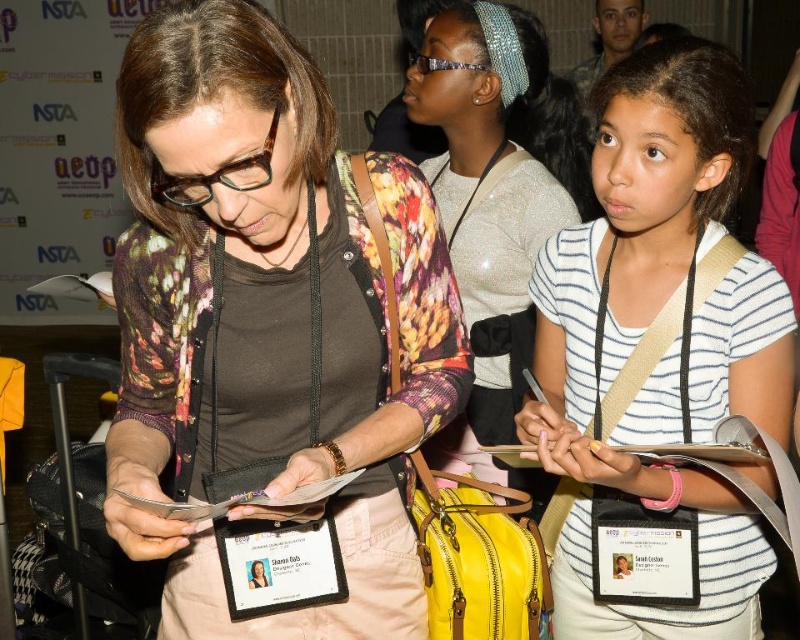
You are standing in the conference area and want to move from point A to point B. Point A is at coordinate point (342, 394) and point B is at coordinate point (484, 164). Which point is closer to you when you start?

Point A at coordinate point (342, 394) is closer to you than point B at coordinate point (484, 164).

You are organizing a photo shoot and need to ensure that the floral cardigan at center and the white striped shirt at center can fit within a 1.2 meter wide backdrop. Based on their widths, can both items be displayed side by side without overlapping?

The floral cardigan at center is wider than the white striped shirt at center. However, without specific measurements, it is impossible to determine if their combined width exceeds 1.2 meters. Additional information about their individual dimensions is required to make an accurate assessment.